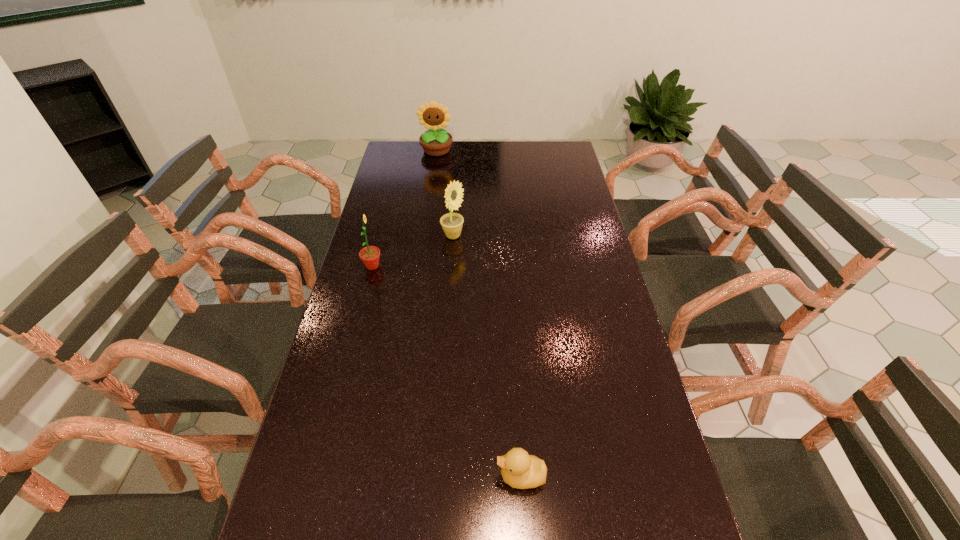
At what (x,y) coordinates should I click in order to perform the action: click on free space located 0.320m on the face of the rightmost object. Please return your answer as a coordinate pair (x, y). The width and height of the screenshot is (960, 540). Looking at the image, I should click on (351, 476).

Where is `free space located 0.360m on the face of the rightmost object`? free space located 0.360m on the face of the rightmost object is located at coordinates (333, 476).

At what (x,y) coordinates should I click in order to perform the action: click on object at the far edge. Please return your answer as a coordinate pair (x, y). The height and width of the screenshot is (540, 960). Looking at the image, I should click on (436, 142).

The image size is (960, 540). Identify the location of object that is at the far left corner. (436, 142).

Where is `vacant space at the far edge of the desktop`? The image size is (960, 540). vacant space at the far edge of the desktop is located at coordinates (489, 150).

You are a GUI agent. You are given a task and a screenshot of the screen. Output one action in this format:
    pyautogui.click(x=<x>, y=<y>)
    Task: Click on the vacant position at the left edge of the desktop
    
    Given the screenshot: What is the action you would take?
    point(350,355)

Identify the location of vacant space at the right edge of the desktop. (555, 179).

Where is `free space at the far right corner of the desktop`? This screenshot has width=960, height=540. free space at the far right corner of the desktop is located at coordinates (541, 151).

Locate an element on the screen. free area in between the farthest object and the duckling is located at coordinates (479, 314).

Locate an element on the screen. This screenshot has width=960, height=540. free space between the third nearest object and the nearest object is located at coordinates (487, 356).